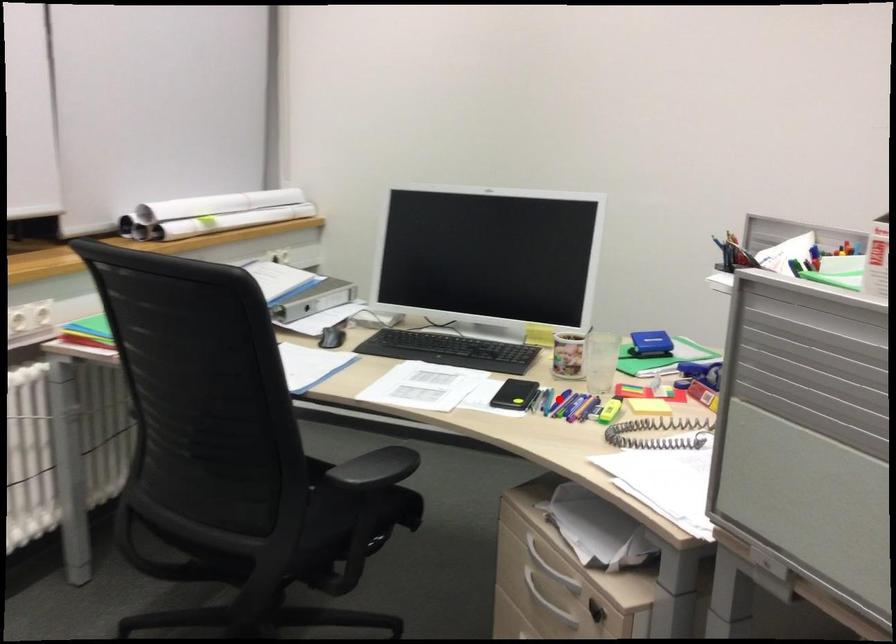
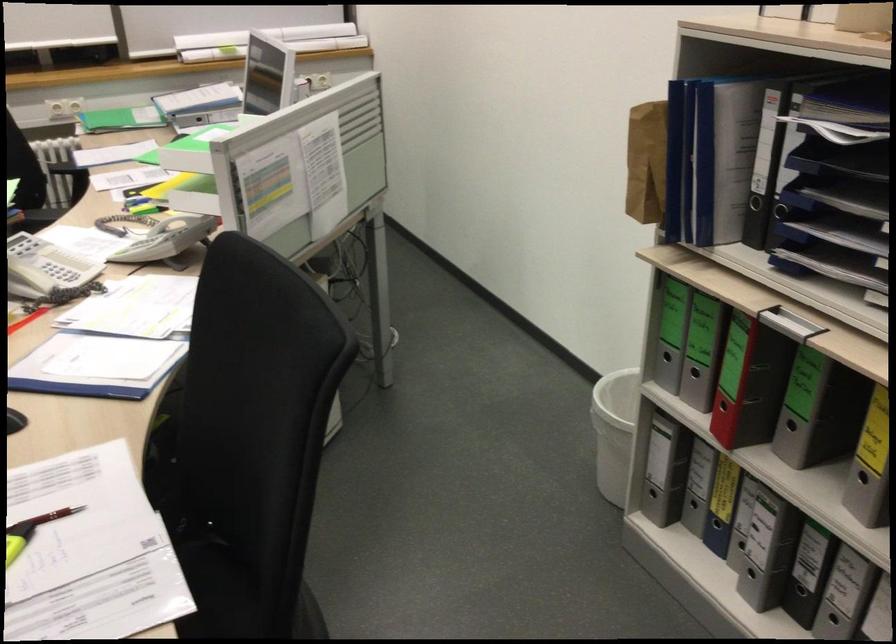
Question: I am providing you with two images of the same scene from different viewpoints. A red point is marked on the first image. Can you still see the location of the red point in image 2?

Choices:
 (A) Yes
 (B) No

Answer: (B)